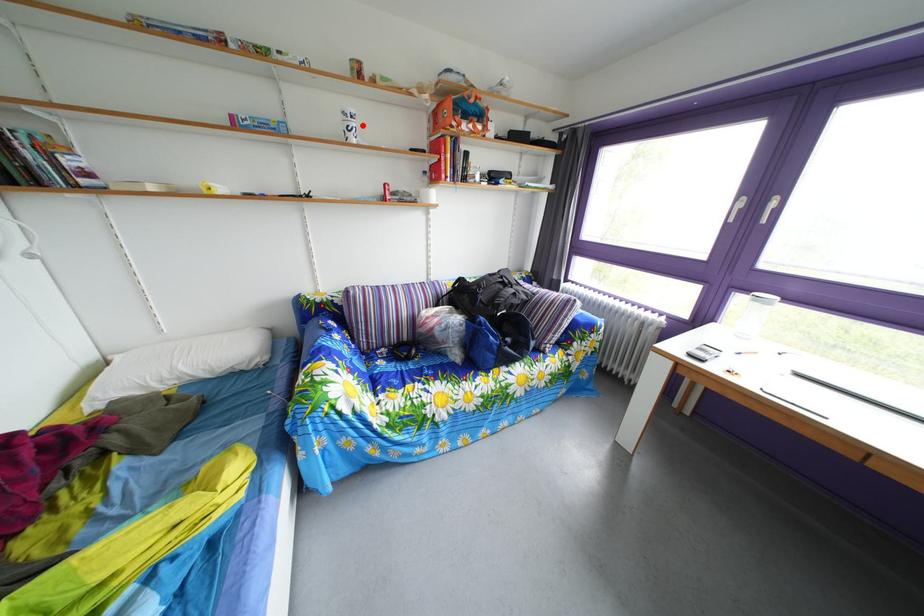
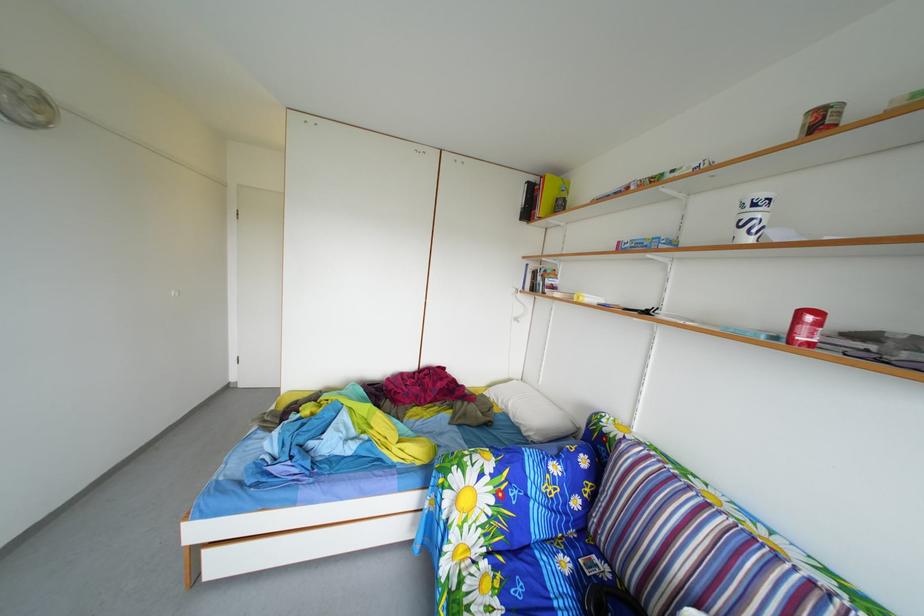
Where in the second image is the point corresponding to the highlighted location from the first image?

(766, 214)